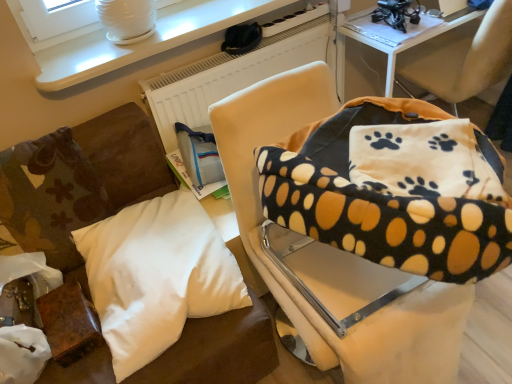
What do you see at coordinates (332, 253) in the screenshot?
I see `soft beige chair at center, placed as the 2th chair when sorted from right to left` at bounding box center [332, 253].

The image size is (512, 384). Identify the location of soft beige chair at center, placed as the 2th chair when sorted from right to left. (332, 253).

What do you see at coordinates (468, 60) in the screenshot?
I see `soft fleece blanket at upper right, which is the second chair from left to right` at bounding box center [468, 60].

This screenshot has height=384, width=512. Describe the element at coordinates (232, 73) in the screenshot. I see `white matte radiator at upper center` at that location.

What do you see at coordinates (423, 161) in the screenshot? This screenshot has width=512, height=384. I see `white fleece pillow at upper right, which is counted as the 3th pillow, starting from the left` at bounding box center [423, 161].

Where is `soft beige chair at center, placed as the 2th chair when sorted from right to left`? The image size is (512, 384). soft beige chair at center, placed as the 2th chair when sorted from right to left is located at coordinates 332,253.

Measure the distance from white glossy table at upper left to white soft pillow at lower left, the third pillow positioned from the right.

The distance of white glossy table at upper left from white soft pillow at lower left, the third pillow positioned from the right, is 16.01 inches.

From their relative heights in the image, would you say white glossy table at upper left is taller or shorter than white soft pillow at lower left, the 1th pillow when ordered from left to right?

white glossy table at upper left is shorter than white soft pillow at lower left, the 1th pillow when ordered from left to right.

Would you say white glossy table at upper left is a long distance from white soft pillow at lower left, the 1th pillow when ordered from left to right?

They are positioned close to each other.

Which is less distant, (x=162, y=14) or (x=55, y=165)?

Clearly, point (x=162, y=14) is more distant from the camera than point (x=55, y=165).

Is white glossy table at upper left not within white soft pillow at lower left, the second pillow in the left-to-right sequence?

white glossy table at upper left lies outside white soft pillow at lower left, the second pillow in the left-to-right sequence,'s area.

From a real-world perspective, who is located higher, white glossy table at upper left or white soft pillow at lower left, acting as the 2th pillow starting from the right?

white glossy table at upper left.

From the image's perspective, which object appears higher, white glossy table at upper left or white soft pillow at lower left, acting as the 2th pillow starting from the right?

white glossy table at upper left is shown above in the image.

Which is further, (148, 45) or (140, 280)?

Point (148, 45)

Does soft fleece blanket at upper right, which is the second chair from left to right, have a smaller size compared to white soft pillow at lower left, the second pillow in the left-to-right sequence?

Incorrect, soft fleece blanket at upper right, which is the second chair from left to right, is not smaller in size than white soft pillow at lower left, the second pillow in the left-to-right sequence.

From the image's perspective, which object appears higher, soft fleece blanket at upper right, which appears as the 1th chair when viewed from the right, or white soft pillow at lower left, acting as the 2th pillow starting from the right?

soft fleece blanket at upper right, which appears as the 1th chair when viewed from the right, appears higher in the image.

How many degrees apart are the facing directions of soft fleece blanket at upper right, which appears as the 1th chair when viewed from the right, and white soft pillow at lower left, acting as the 2th pillow starting from the right?

The angular difference between soft fleece blanket at upper right, which appears as the 1th chair when viewed from the right, and white soft pillow at lower left, acting as the 2th pillow starting from the right, is 179 degrees.

Considering their positions, is soft fleece blanket at upper right, which is the second chair from left to right, located in front of or behind white soft pillow at lower left, the second pillow in the left-to-right sequence?

soft fleece blanket at upper right, which is the second chair from left to right, is positioned farther from the viewer than white soft pillow at lower left, the second pillow in the left-to-right sequence.

Is white fleece pillow at upper right, which is counted as the 3th pillow, starting from the left, inside the boundaries of soft beige chair at center, acting as the 1th chair starting from the left, or outside?

white fleece pillow at upper right, which is counted as the 3th pillow, starting from the left, exists entirely within soft beige chair at center, acting as the 1th chair starting from the left.

Does white fleece pillow at upper right, which is counted as the 3th pillow, starting from the left, come in front of soft beige chair at center, acting as the 1th chair starting from the left?

No, white fleece pillow at upper right, which is counted as the 3th pillow, starting from the left, is further to the viewer.

From a real-world perspective, is white fleece pillow at upper right, which ranks as the 1th pillow in right-to-left order, physically located above or below soft beige chair at center, placed as the 2th chair when sorted from right to left?

white fleece pillow at upper right, which ranks as the 1th pillow in right-to-left order, is above soft beige chair at center, placed as the 2th chair when sorted from right to left.

Is point (163, 131) farther from camera compared to point (85, 219)?

Yes, point (163, 131) is farther from viewer.

Where is `radiator below the white soft pillow at lower left, the 1th pillow when ordered from left to right (from a real-world perspective)`? The width and height of the screenshot is (512, 384). radiator below the white soft pillow at lower left, the 1th pillow when ordered from left to right (from a real-world perspective) is located at coordinates (232, 73).

From a real-world perspective, is white matte radiator at upper center on top of white soft pillow at lower left, the 1th pillow when ordered from left to right?

Actually, white matte radiator at upper center is physically below white soft pillow at lower left, the 1th pillow when ordered from left to right, in the real world.

Is white matte radiator at upper center turned away from white soft pillow at lower left, the 1th pillow when ordered from left to right?

No, white soft pillow at lower left, the 1th pillow when ordered from left to right, is not at the back of white matte radiator at upper center.

Is white fleece pillow at upper right, which is counted as the 3th pillow, starting from the left, not close to white glossy table at upper left?

No, white fleece pillow at upper right, which is counted as the 3th pillow, starting from the left, is in close proximity to white glossy table at upper left.

Measure the distance from white fleece pillow at upper right, which is counted as the 3th pillow, starting from the left, to white glossy table at upper left.

The distance of white fleece pillow at upper right, which is counted as the 3th pillow, starting from the left, from white glossy table at upper left is 39.12 inches.

From a real-world perspective, who is located higher, white fleece pillow at upper right, which is counted as the 3th pillow, starting from the left, or white glossy table at upper left?

white fleece pillow at upper right, which is counted as the 3th pillow, starting from the left, from a real-world perspective.

Considering the positions of objects white fleece pillow at upper right, which is counted as the 3th pillow, starting from the left, and white glossy table at upper left in the image provided, who is in front, white fleece pillow at upper right, which is counted as the 3th pillow, starting from the left, or white glossy table at upper left?

white fleece pillow at upper right, which is counted as the 3th pillow, starting from the left, is closer to the camera.

Does white glossy table at upper left have a greater height compared to soft fleece blanket at upper right, which appears as the 1th chair when viewed from the right?

In fact, white glossy table at upper left may be shorter than soft fleece blanket at upper right, which appears as the 1th chair when viewed from the right.

Consider the image. Which is nearer, (185,5) or (455,110)?

Point (185,5) appears to be closer to the viewer than point (455,110).

Is white glossy table at upper left not inside soft fleece blanket at upper right, which appears as the 1th chair when viewed from the right?

That's correct, white glossy table at upper left is outside of soft fleece blanket at upper right, which appears as the 1th chair when viewed from the right.

Is white glossy table at upper left beside soft fleece blanket at upper right, which appears as the 1th chair when viewed from the right?

white glossy table at upper left and soft fleece blanket at upper right, which appears as the 1th chair when viewed from the right, are not in contact.

You are a GUI agent. You are given a task and a screenshot of the screen. Output one action in this format:
    pyautogui.click(x=<x>, y=<y>)
    Task: Click on the 2nd pillow below when counting from the white glossy table at upper left (from the image's perspective)
    The height and width of the screenshot is (384, 512).
    Given the screenshot: What is the action you would take?
    pyautogui.click(x=50, y=196)

Identify the location of pillow that is the 1st object to the left of the white glossy table at upper left, starting at the anchor. Image resolution: width=512 pixels, height=384 pixels. (157, 275).

Estimate the real-world distances between objects in this image. Which object is further from white matte radiator at upper center, soft fleece blanket at upper right, which appears as the 1th chair when viewed from the right, or soft beige chair at center, acting as the 1th chair starting from the left?

soft beige chair at center, acting as the 1th chair starting from the left.

When comparing their distances from soft beige chair at center, placed as the 2th chair when sorted from right to left, does white glossy table at upper left or white fleece pillow at upper right, which ranks as the 1th pillow in right-to-left order, seem closer?

white fleece pillow at upper right, which ranks as the 1th pillow in right-to-left order.

Looking at the image, which one is located further to white soft pillow at lower left, acting as the 2th pillow starting from the right, soft beige chair at center, placed as the 2th chair when sorted from right to left, or white soft pillow at lower left, the third pillow positioned from the right?

Among the two, soft beige chair at center, placed as the 2th chair when sorted from right to left, is located further to white soft pillow at lower left, acting as the 2th pillow starting from the right.

Looking at the image, which one is located further to soft fleece blanket at upper right, which appears as the 1th chair when viewed from the right, soft beige chair at center, placed as the 2th chair when sorted from right to left, or white fleece pillow at upper right, which ranks as the 1th pillow in right-to-left order?

The object further to soft fleece blanket at upper right, which appears as the 1th chair when viewed from the right, is white fleece pillow at upper right, which ranks as the 1th pillow in right-to-left order.

From the image, which object appears to be nearer to white soft pillow at lower left, the third pillow positioned from the right, white glossy table at upper left or white matte radiator at upper center?

Based on the image, white glossy table at upper left appears to be nearer to white soft pillow at lower left, the third pillow positioned from the right.

Looking at the image, which one is located further to white matte radiator at upper center, white glossy table at upper left or soft beige chair at center, acting as the 1th chair starting from the left?

soft beige chair at center, acting as the 1th chair starting from the left, is positioned further to the anchor white matte radiator at upper center.

From the picture: From the image, which object appears to be farther from white soft pillow at lower left, the third pillow positioned from the right, white matte radiator at upper center or white glossy table at upper left?

Based on the image, white matte radiator at upper center appears to be further to white soft pillow at lower left, the third pillow positioned from the right.

Based on their spatial positions, is white glossy table at upper left or soft beige chair at center, placed as the 2th chair when sorted from right to left, further from white soft pillow at lower left, the second pillow in the left-to-right sequence?

Based on the image, white glossy table at upper left appears to be further to white soft pillow at lower left, the second pillow in the left-to-right sequence.

At what (x,y) coordinates should I click in order to perform the action: click on pillow between white soft pillow at lower left, the third pillow positioned from the right, and soft beige chair at center, placed as the 2th chair when sorted from right to left, from left to right. Please return your answer as a coordinate pair (x, y). The image size is (512, 384). Looking at the image, I should click on (157, 275).

Where is `radiator between white glossy table at upper left and white soft pillow at lower left, the second pillow in the left-to-right sequence, in the vertical direction`? radiator between white glossy table at upper left and white soft pillow at lower left, the second pillow in the left-to-right sequence, in the vertical direction is located at coordinates (232, 73).

Image resolution: width=512 pixels, height=384 pixels. Identify the location of chair located between white soft pillow at lower left, acting as the 2th pillow starting from the right, and soft fleece blanket at upper right, which is the second chair from left to right, in the left-right direction. (332, 253).

This screenshot has width=512, height=384. I want to click on table located between white soft pillow at lower left, the third pillow positioned from the right, and soft beige chair at center, placed as the 2th chair when sorted from right to left, in the left-right direction, so click(x=145, y=40).